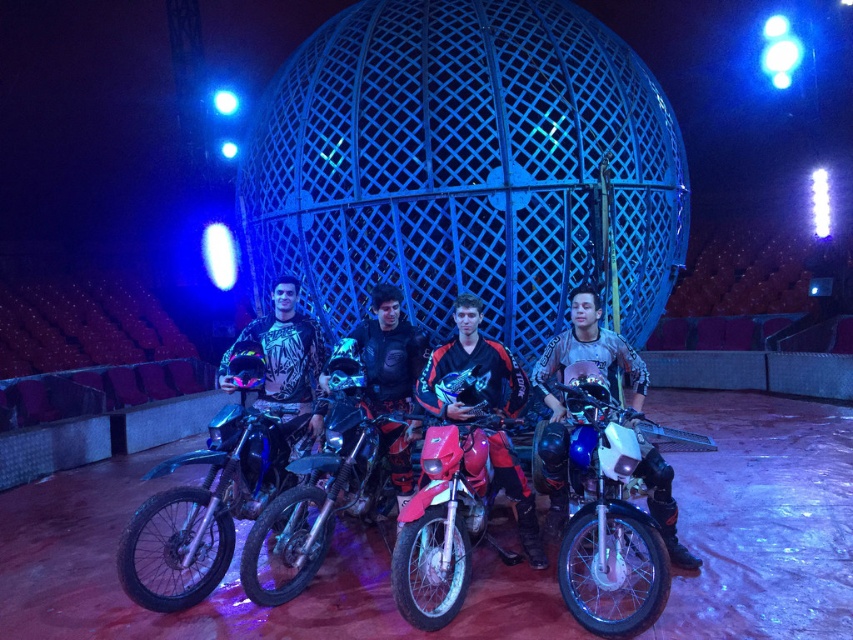
Between blue metallic motorcycle at center and matte black dirt bike at center, which one appears on the left side from the viewer's perspective?

matte black dirt bike at center is more to the left.

At what (x,y) coordinates should I click in order to perform the action: click on blue metallic motorcycle at center. Please return your answer as a coordinate pair (x, y). Looking at the image, I should click on (606, 518).

Locate an element on the screen. The image size is (853, 640). blue metallic motorcycle at center is located at coordinates (606, 518).

How far apart are blue metallic motorcycle at center and black matte jacket at center?

A distance of 2.07 meters exists between blue metallic motorcycle at center and black matte jacket at center.

Which is behind, point (575, 486) or point (387, 429)?

Point (387, 429)

Does point (590, 445) come behind point (405, 392)?

No, it is in front of (405, 392).

Find the location of a particular element. The width and height of the screenshot is (853, 640). blue metallic motorcycle at center is located at coordinates (606, 518).

Can you confirm if blue metallic motorcycle at center is thinner than red matte motorcycle at center?

Correct, blue metallic motorcycle at center's width is less than red matte motorcycle at center's.

Which of these two, blue metallic motorcycle at center or red matte motorcycle at center, stands taller?

Standing taller between the two is red matte motorcycle at center.

Identify the location of blue metallic motorcycle at center. The height and width of the screenshot is (640, 853). (606, 518).

The width and height of the screenshot is (853, 640). I want to click on blue metallic motorcycle at center, so (606, 518).